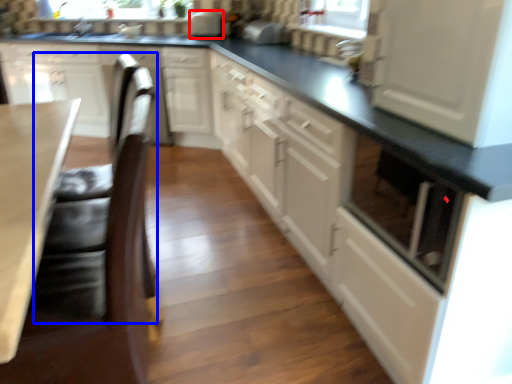
Question: Which of the following is the farthest to the observer, appliance (highlighted by a red box) or swivel chair (highlighted by a blue box)?

Choices:
 (A) appliance
 (B) swivel chair

Answer: (A)